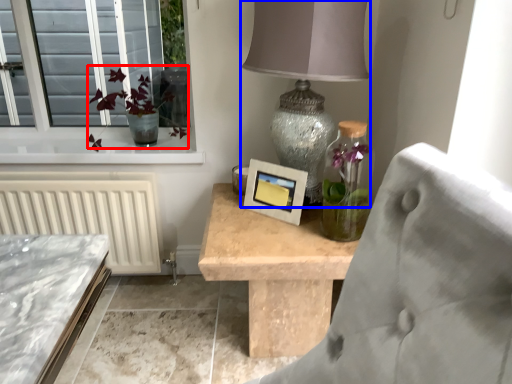
Question: Among these objects, which one is nearest to the camera, floral arrangement (highlighted by a red box) or table lamp (highlighted by a blue box)?

Choices:
 (A) floral arrangement
 (B) table lamp

Answer: (B)